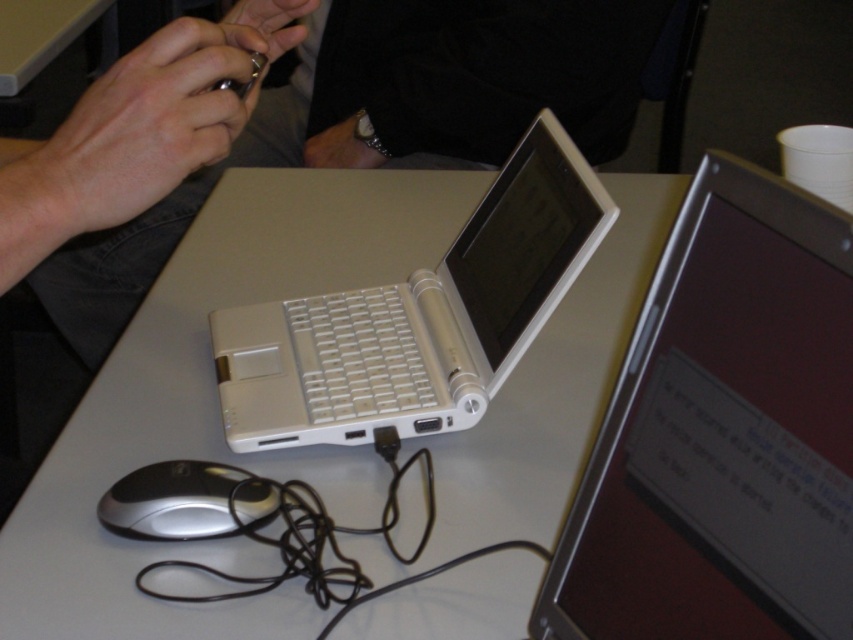
You are trying to place a rectangular box that measures 15 cm in length and 10 cm in width on the white plastic table at center. Based on the table dimensions provided in the scene description, will the box fit on the table without overhanging the edges?

The white plastic table at center is located at point (213, 403), but the dimensions of the table are not provided in the scene description. Therefore, it is impossible to determine if the box will fit without overhanging the edges.

You are organizing a jewelry display and need to place the matte silver ring at upper left and the white leather ring at center into a narrow box. Which ring has a larger width and should be placed first to ensure they both fit?

The matte silver ring at upper left has a larger width than the white leather ring at center, so it should be placed first in the narrow box to ensure both fit properly.

Based on the photo, you are taking a photo of the silver metallic laptop at center. If your camera has a minimum focus distance of 10 inches, will the laptop be in focus?

The silver metallic laptop at center is 10.80 inches from camera, which is beyond the camera minimum focus distance of 10 inches, so the laptop will be in focus.